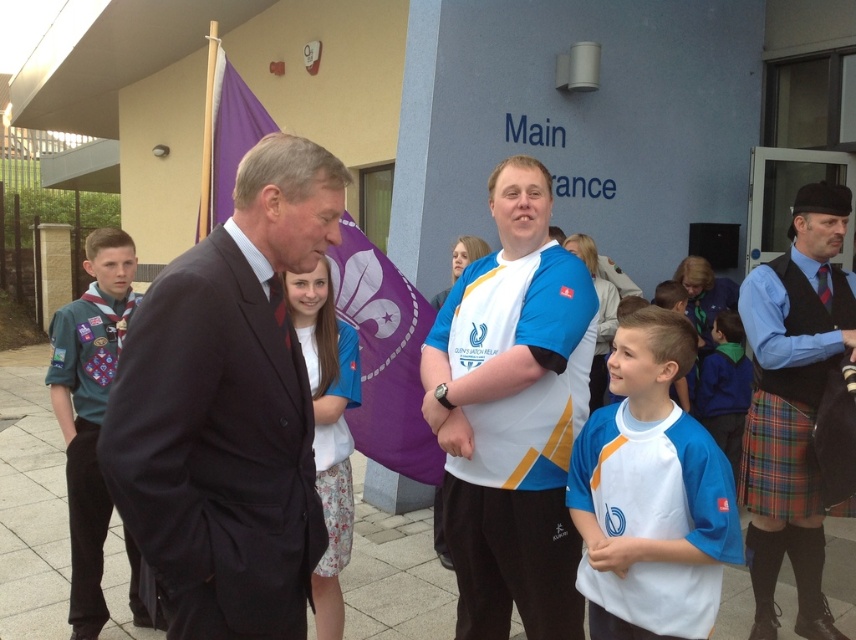
Question: Does white jersey at center come behind teal fabric vest at left?

Choices:
 (A) yes
 (B) no

Answer: (B)

Question: Which point is farther to the camera?

Choices:
 (A) (584, 397)
 (B) (744, 364)
 (C) (100, 602)

Answer: (B)

Question: Is white jersey at center smaller than teal fabric vest at left?

Choices:
 (A) no
 (B) yes

Answer: (B)

Question: Which point is farther from the camera taking this photo?

Choices:
 (A) (195, 232)
 (B) (777, 477)
 (C) (235, 458)

Answer: (A)

Question: Which point appears closest to the camera in this image?

Choices:
 (A) (330, 301)
 (B) (821, 360)
 (C) (60, 420)
 (D) (207, 506)

Answer: (D)

Question: Is teal fabric vest at left in front of white fabric shirt at center?

Choices:
 (A) yes
 (B) no

Answer: (B)